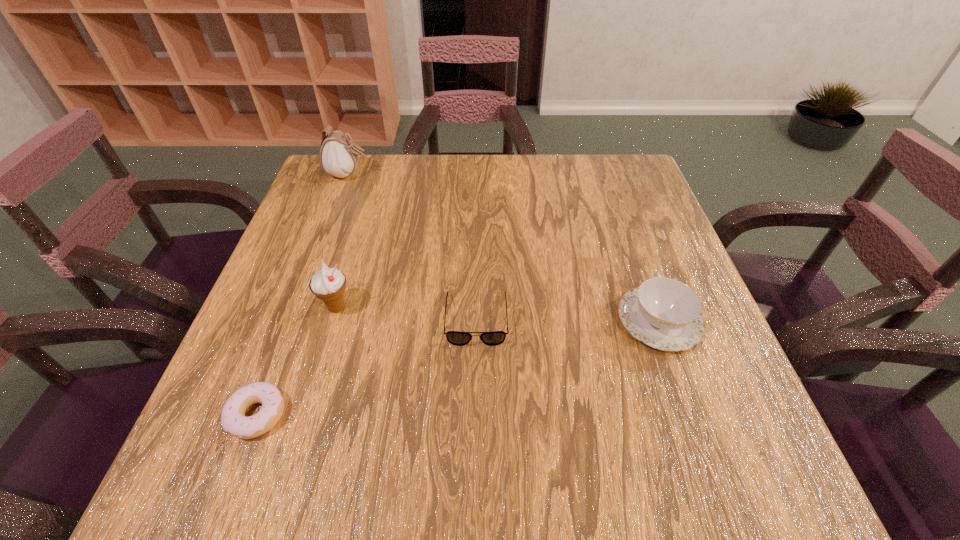
Locate an element on the screen. Image resolution: width=960 pixels, height=540 pixels. object at the far left corner is located at coordinates (339, 155).

I want to click on object that is at the near left corner, so click(x=233, y=419).

Locate an element on the screen. This screenshot has height=540, width=960. blank space at the far edge of the desktop is located at coordinates (514, 187).

Find the location of `blank area at the near edge`. blank area at the near edge is located at coordinates (590, 465).

Find the location of a particular element. Image resolution: width=960 pixels, height=540 pixels. vacant space at the left edge of the desktop is located at coordinates (307, 364).

In the image, there is a desktop. Where is `vacant space at the right edge`? The width and height of the screenshot is (960, 540). vacant space at the right edge is located at coordinates (666, 352).

This screenshot has height=540, width=960. Find the location of `vacant region at the far left corner of the desktop`. vacant region at the far left corner of the desktop is located at coordinates (356, 178).

Identify the location of vacant space at the far right corner of the desktop. The image size is (960, 540). (625, 168).

Identify the location of free spot between the pouch and the rightmost object. click(504, 247).

In order to click on vacant space in between the icecream and the nearest object in this screenshot , I will do click(x=297, y=361).